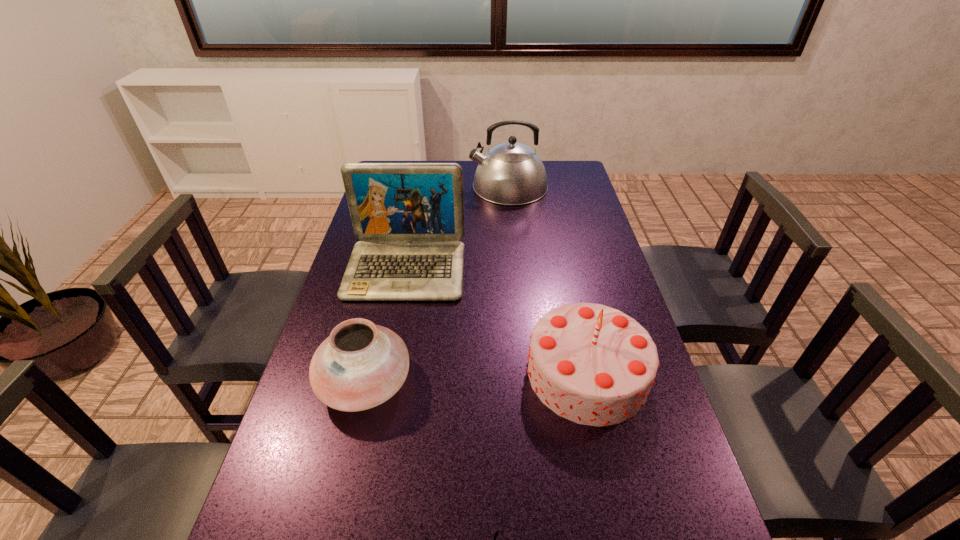
This screenshot has width=960, height=540. Find the location of `object that is at the far edge`. object that is at the far edge is located at coordinates (511, 173).

Image resolution: width=960 pixels, height=540 pixels. I want to click on laptop computer that is at the left edge, so click(x=409, y=216).

Find the location of `pottery that is at the left edge`. pottery that is at the left edge is located at coordinates (361, 365).

Where is `kettle located in the right edge section of the desktop`? kettle located in the right edge section of the desktop is located at coordinates (x=511, y=173).

Locate an element on the screen. The height and width of the screenshot is (540, 960). birthday cake located in the right edge section of the desktop is located at coordinates (592, 364).

Image resolution: width=960 pixels, height=540 pixels. I want to click on object present at the far right corner, so click(x=511, y=173).

At what (x,y) coordinates should I click in order to perform the action: click on vacant space at the left edge of the desktop. Please return your answer as a coordinate pair (x, y). Image resolution: width=960 pixels, height=540 pixels. Looking at the image, I should click on (368, 303).

Image resolution: width=960 pixels, height=540 pixels. Find the location of `free space at the right edge`. free space at the right edge is located at coordinates tap(569, 267).

This screenshot has width=960, height=540. Find the location of `vacant space at the far left corner of the desktop`. vacant space at the far left corner of the desktop is located at coordinates [x=412, y=163].

Find the location of a particular element. free spot at the far right corner of the desktop is located at coordinates (570, 175).